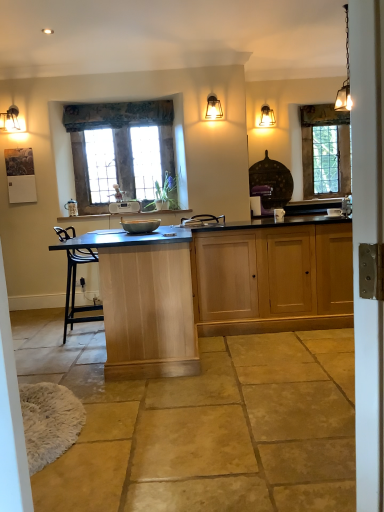
Question: Does floral fabric curtain at upper center appear on the left side of matte glass pendant light at upper right, the 1th lamp positioned from the back?

Choices:
 (A) no
 (B) yes

Answer: (B)

Question: From a real-world perspective, is floral fabric curtain at upper center on matte glass pendant light at upper right, which is the 3th lamp from left to right?

Choices:
 (A) yes
 (B) no

Answer: (A)

Question: From a real-world perspective, is floral fabric curtain at upper center located beneath matte glass pendant light at upper right, the 4th lamp in the front-to-back sequence?

Choices:
 (A) no
 (B) yes

Answer: (A)

Question: Considering the relative sizes of floral fabric curtain at upper center and matte glass pendant light at upper right, which is the 3th lamp from left to right, in the image provided, is floral fabric curtain at upper center bigger than matte glass pendant light at upper right, which is the 3th lamp from left to right,?

Choices:
 (A) yes
 (B) no

Answer: (A)

Question: Does floral fabric curtain at upper center appear on the right side of matte glass pendant light at upper right, the 4th lamp in the front-to-back sequence?

Choices:
 (A) yes
 (B) no

Answer: (B)

Question: Based on their positions, is wooden-framed window at center, which is the second window from right to left, located to the left or right of metallic chain-link lamp at upper right, placed as the fourth lamp when sorted from back to front?

Choices:
 (A) left
 (B) right

Answer: (A)

Question: From a real-world perspective, is wooden-framed window at center, which appears as the first window when viewed from the front, physically located above or below metallic chain-link lamp at upper right, placed as the fourth lamp when sorted from back to front?

Choices:
 (A) above
 (B) below

Answer: (B)

Question: Is wooden-framed window at center, which is the 1th window from left to right, inside or outside of metallic chain-link lamp at upper right, which ranks as the 1th lamp in front-to-back order?

Choices:
 (A) inside
 (B) outside

Answer: (B)

Question: Looking at their shapes, would you say wooden-framed window at center, which appears as the first window when viewed from the front, is wider or thinner than metallic chain-link lamp at upper right, which ranks as the 1th lamp in front-to-back order?

Choices:
 (A) wide
 (B) thin

Answer: (B)

Question: Considering the relative positions of white plastic radio at center and matte black wall sconce at upper left, which is counted as the third lamp, starting from the back, in the image provided, is white plastic radio at center to the left or to the right of matte black wall sconce at upper left, which is counted as the third lamp, starting from the back,?

Choices:
 (A) right
 (B) left

Answer: (A)

Question: Is white plastic radio at center inside or outside of matte black wall sconce at upper left, which is counted as the third lamp, starting from the back?

Choices:
 (A) outside
 (B) inside

Answer: (A)

Question: In terms of height, does white plastic radio at center look taller or shorter compared to matte black wall sconce at upper left, arranged as the 2th lamp when viewed from the front?

Choices:
 (A) short
 (B) tall

Answer: (A)

Question: In the image, is white plastic radio at center positioned in front of or behind matte black wall sconce at upper left, which is counted as the third lamp, starting from the back?

Choices:
 (A) behind
 (B) front

Answer: (A)

Question: From the image's perspective, relative to wooden-framed window at center, which is the second window from right to left, is white plastic radio at center above or below?

Choices:
 (A) below
 (B) above

Answer: (A)

Question: Is white plastic radio at center bigger or smaller than wooden-framed window at center, which is the second window from right to left?

Choices:
 (A) small
 (B) big

Answer: (A)